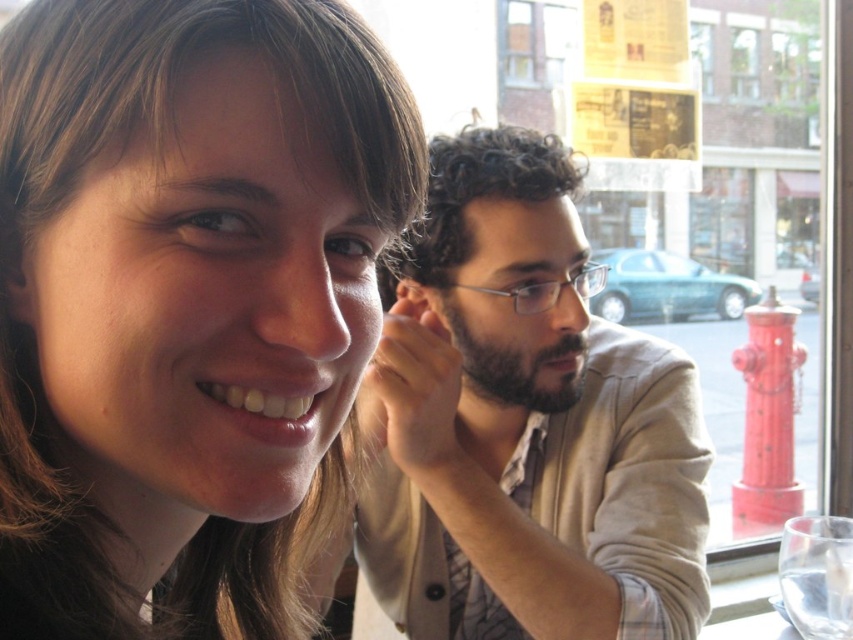
Question: Considering the relative positions of light beige sweater at center and clear glass at lower right in the image provided, where is light beige sweater at center located with respect to clear glass at lower right?

Choices:
 (A) left
 (B) right

Answer: (A)

Question: Which point appears closest to the camera in this image?

Choices:
 (A) (804, 593)
 (B) (703, 508)

Answer: (A)

Question: Is light beige sweater at center to the left of clear glass at lower right from the viewer's perspective?

Choices:
 (A) yes
 (B) no

Answer: (A)

Question: Which is farther from the matte brown hair at upper left?

Choices:
 (A) light beige sweater at center
 (B) clear glass at lower right

Answer: (B)

Question: Is light beige sweater at center further to the viewer compared to clear glass at lower right?

Choices:
 (A) no
 (B) yes

Answer: (A)

Question: Which point is closer to the camera?

Choices:
 (A) (805, 586)
 (B) (692, 372)
 (C) (28, 390)

Answer: (C)